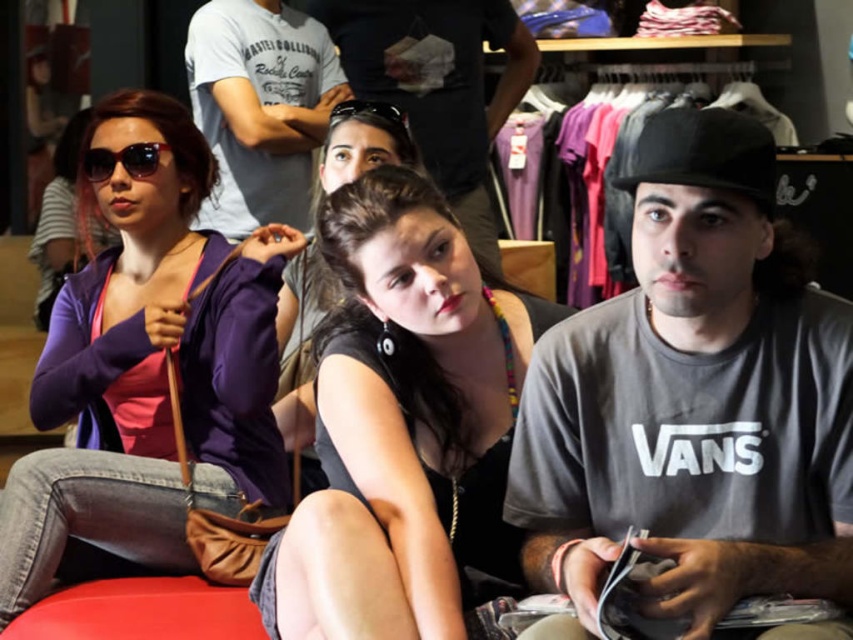
Question: Which point is closer to the camera taking this photo?

Choices:
 (A) (82, 525)
 (B) (485, 253)
 (C) (564, 620)

Answer: (C)

Question: Which object is closer to the camera taking this photo?

Choices:
 (A) black reflective sunglasses at upper left
 (B) black matte goggles at center
 (C) purple soft fabric jacket at left

Answer: (C)

Question: Is purple soft fabric jacket at left bigger than matte gray t-shirt at center?

Choices:
 (A) no
 (B) yes

Answer: (B)

Question: Is white cotton t-shirt at upper center smaller than matte gray t-shirt at center?

Choices:
 (A) no
 (B) yes

Answer: (B)

Question: Which of the following is the farthest from the observer?

Choices:
 (A) (378, 100)
 (B) (45, 490)
 (C) (137, 161)

Answer: (A)

Question: Can you confirm if purple soft fabric jacket at left is bigger than black matte goggles at center?

Choices:
 (A) yes
 (B) no

Answer: (A)